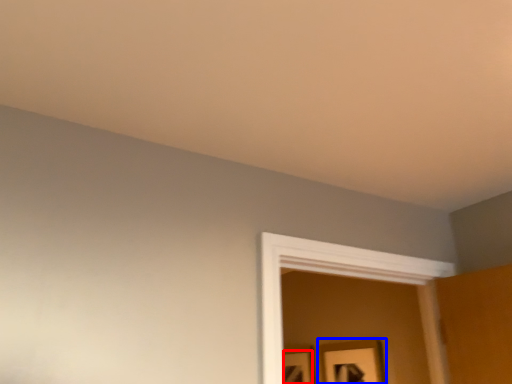
Question: Among these objects, which one is nearest to the camera, picture frame (highlighted by a red box) or picture frame (highlighted by a blue box)?

Choices:
 (A) picture frame
 (B) picture frame

Answer: (B)